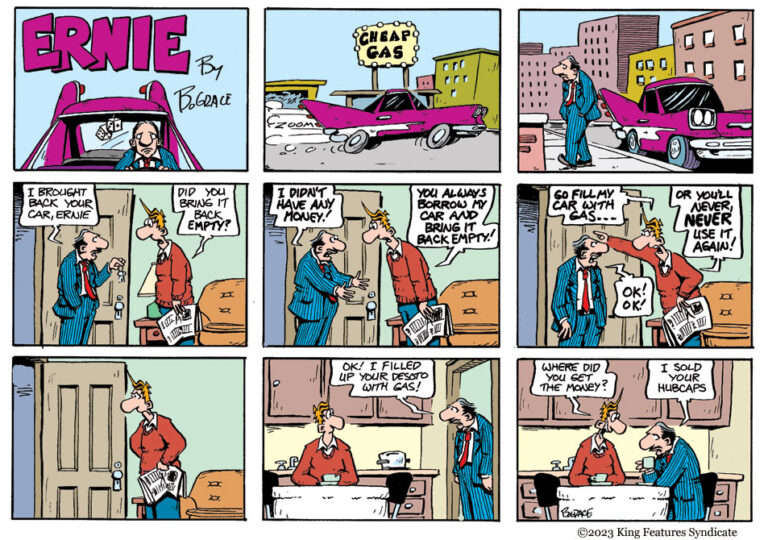
Locate an element on the screen. Image resolution: width=768 pixels, height=540 pixels. kitchen cabinet door is located at coordinates (293, 381), (346, 399), (389, 411), (528, 402), (583, 401), (633, 368), (697, 405).